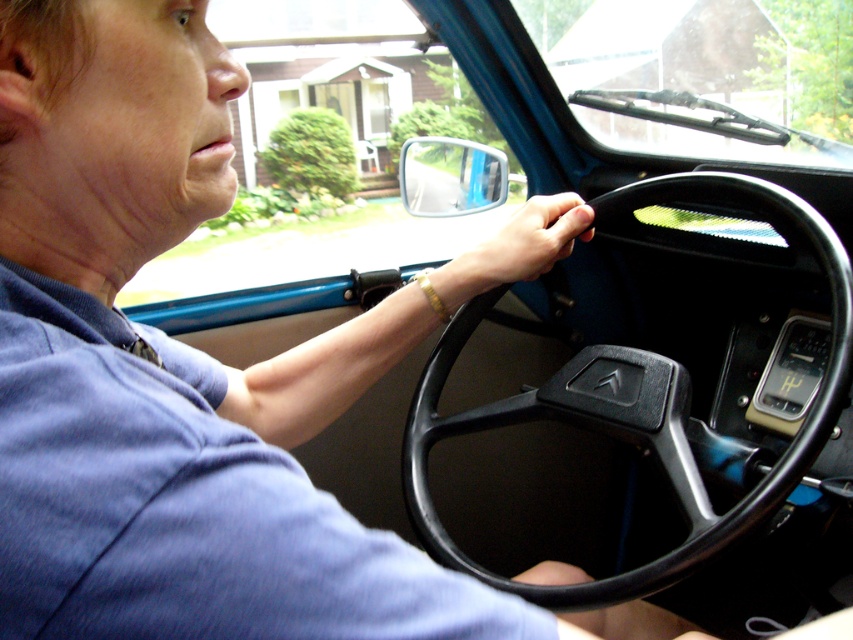
Looking at this image, is the position of blue cotton shirt at center less distant than that of black plastic steering wheel at center?

Yes, blue cotton shirt at center is in front of black plastic steering wheel at center.

Is blue cotton shirt at center bigger than black plastic steering wheel at center?

Incorrect, blue cotton shirt at center is not larger than black plastic steering wheel at center.

Who is more forward, (490,600) or (550,392)?

Point (490,600) is more forward.

Locate an element on the screen. This screenshot has width=853, height=640. blue cotton shirt at center is located at coordinates (183, 502).

Who is positioned more to the right, black plastic steering wheel at center or black rubber hand at center?

black plastic steering wheel at center is more to the right.

Does black plastic steering wheel at center have a lesser width compared to black rubber hand at center?

No, black plastic steering wheel at center is not thinner than black rubber hand at center.

Locate an element on the screen. black plastic steering wheel at center is located at coordinates (637, 404).

Locate an element on the screen. This screenshot has width=853, height=640. black plastic steering wheel at center is located at coordinates (637, 404).

Is black plastic steering wheel at center below gold bracelet at center?

Correct, black plastic steering wheel at center is located below gold bracelet at center.

Which of these two, black plastic steering wheel at center or gold bracelet at center, stands taller?

Standing taller between the two is black plastic steering wheel at center.

Is point (426, 432) more distant than point (440, 291)?

Yes, point (426, 432) is behind point (440, 291).

At what (x,y) coordinates should I click in order to perform the action: click on black plastic steering wheel at center. Please return your answer as a coordinate pair (x, y). Looking at the image, I should click on (637, 404).